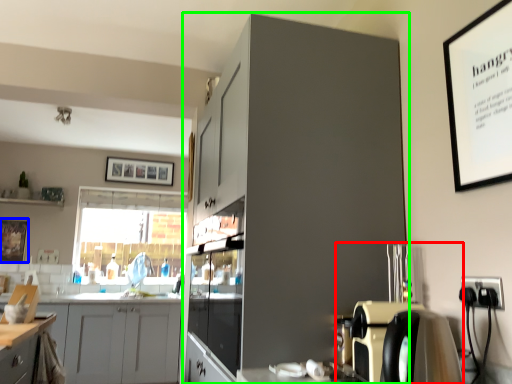
Question: Which is nearer to the coffee machine (highlighted by a red box)? picture frame (highlighted by a blue box) or cabinetry (highlighted by a green box).

Choices:
 (A) picture frame
 (B) cabinetry

Answer: (B)